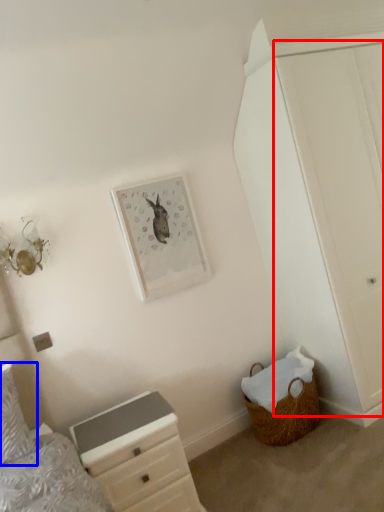
Question: Which of the following is the closest to the observer, door (highlighted by a red box) or pillow (highlighted by a blue box)?

Choices:
 (A) door
 (B) pillow

Answer: (B)